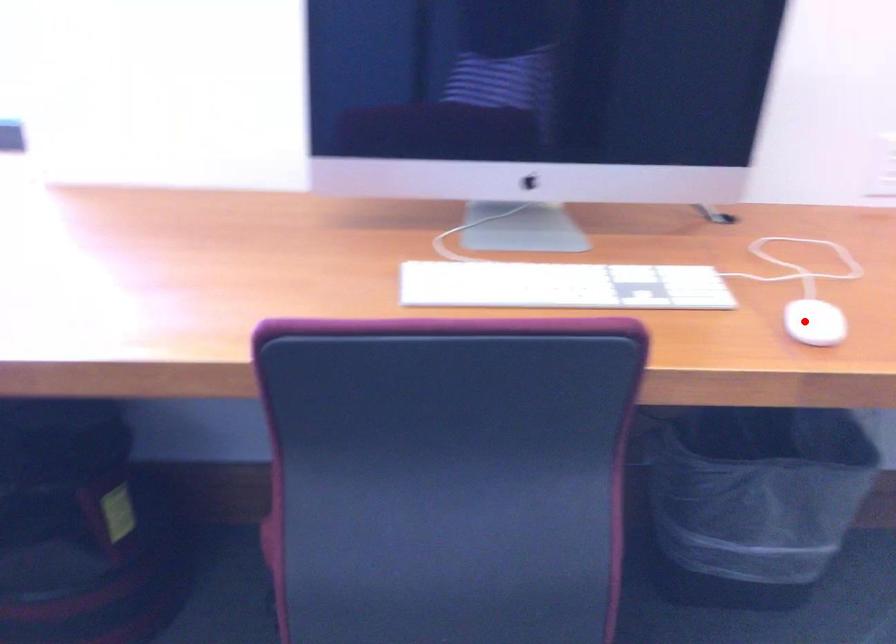
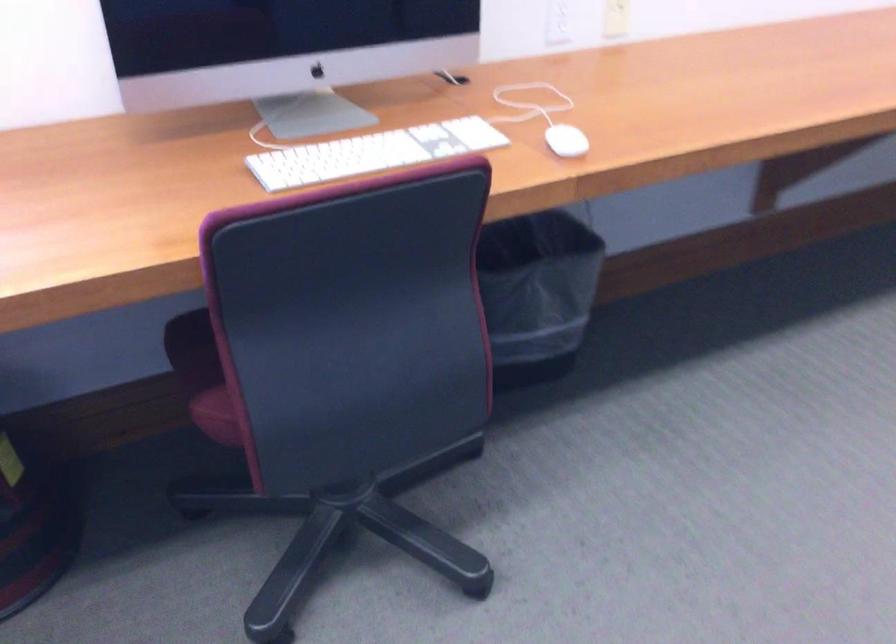
Question: I am providing you with two images of the same scene from different viewpoints. A red point is shown in image1. For the corresponding object point in image2, is it positioned nearer or farther from the camera?

Choices:
 (A) Nearer
 (B) Farther

Answer: (B)